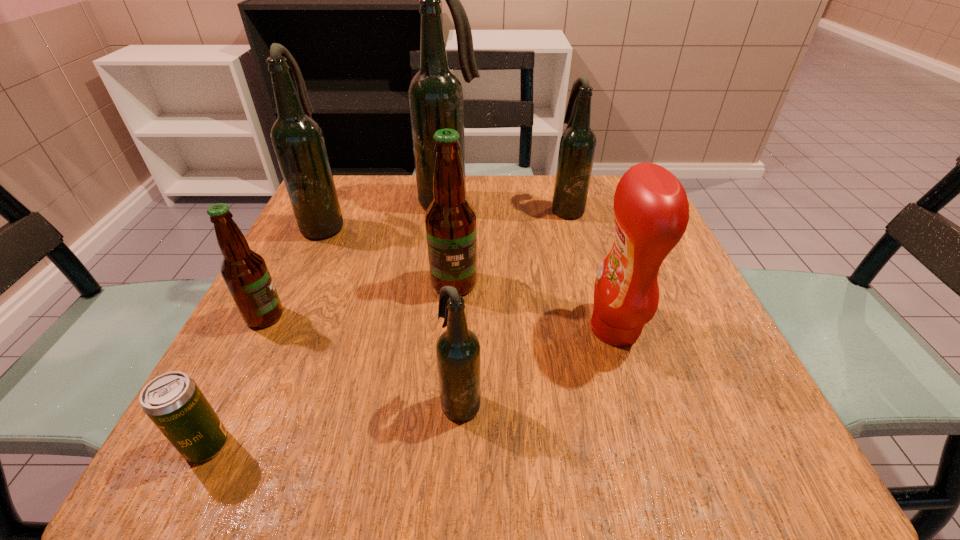
Locate an element on the screen. the biggest dark beer bottle is located at coordinates click(x=435, y=95).

Locate an element on the screen. the tallest beer bottle is located at coordinates (435, 95).

The width and height of the screenshot is (960, 540). Find the location of `the fifth shortest beer bottle`. the fifth shortest beer bottle is located at coordinates (298, 141).

The height and width of the screenshot is (540, 960). Find the location of `the second biggest dark beer bottle`. the second biggest dark beer bottle is located at coordinates click(x=298, y=141).

Locate an element on the screen. This screenshot has width=960, height=540. the rightmost beer bottle is located at coordinates (577, 147).

The height and width of the screenshot is (540, 960). Identify the location of the second smallest dark beer bottle. (577, 147).

Identify the location of the bigger brown beer bottle. The image size is (960, 540). (450, 220).

This screenshot has height=540, width=960. Identify the location of the farther brown beer bottle. (450, 220).

Where is `condiment`? The height and width of the screenshot is (540, 960). condiment is located at coordinates (651, 210).

Image resolution: width=960 pixels, height=540 pixels. I want to click on the left brown beer bottle, so click(244, 271).